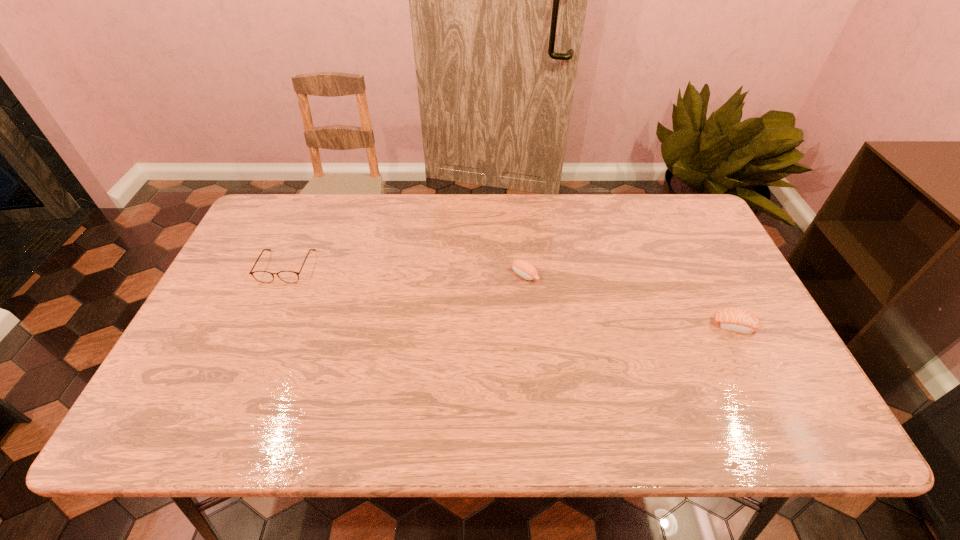
Locate an element on the screen. free space that satisfies the following two spatial constraints: 1. on the front side of the second object from left to right; 2. on the left side of the right sushi is located at coordinates (530, 326).

The height and width of the screenshot is (540, 960). What are the coordinates of `vacant space that satisfies the following two spatial constraints: 1. on the front-facing side of the leftmost object; 2. on the left side of the left sushi` in the screenshot? It's located at (282, 275).

Locate an element on the screen. Image resolution: width=960 pixels, height=540 pixels. vacant area that satisfies the following two spatial constraints: 1. on the front-facing side of the leftmost object; 2. on the right side of the left sushi is located at coordinates (282, 275).

Locate an element on the screen. The image size is (960, 540). free region that satisfies the following two spatial constraints: 1. on the front-facing side of the farther sushi; 2. on the left side of the spectacles is located at coordinates (x=282, y=275).

Locate an element on the screen. vacant position in the image that satisfies the following two spatial constraints: 1. on the front-facing side of the rightmost object; 2. on the right side of the spectacles is located at coordinates (260, 326).

Locate an element on the screen. vacant space that satisfies the following two spatial constraints: 1. on the front-facing side of the nearer sushi; 2. on the right side of the spectacles is located at coordinates (260, 326).